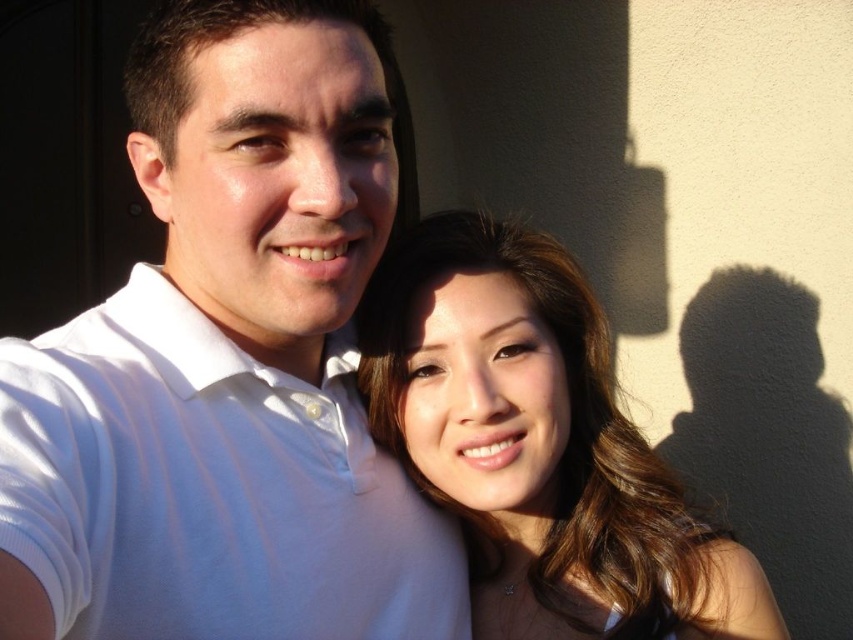
Question: In this image, where is white smooth shirt at center located relative to smooth brown hair at center?

Choices:
 (A) right
 (B) left

Answer: (B)

Question: Which point appears farthest from the camera in this image?

Choices:
 (A) (498, 352)
 (B) (137, 176)

Answer: (A)

Question: Does white smooth shirt at center appear under smooth brown hair at center?

Choices:
 (A) no
 (B) yes

Answer: (A)

Question: Is white smooth shirt at center above smooth brown hair at center?

Choices:
 (A) no
 (B) yes

Answer: (B)